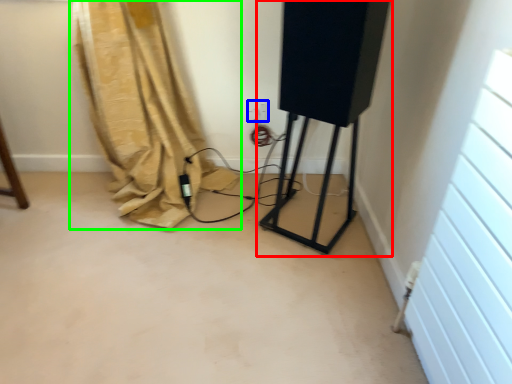
Question: Which is nearer to the equipment (highlighted by a red box)? electric outlet (highlighted by a blue box) or curtain (highlighted by a green box).

Choices:
 (A) electric outlet
 (B) curtain

Answer: (A)